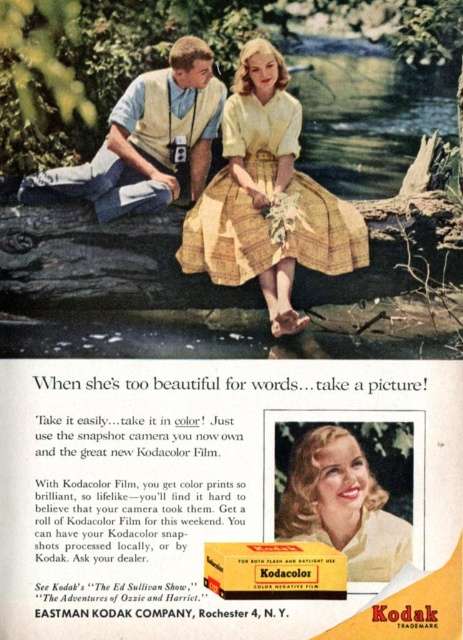
Can you confirm if yellow matte dress at center is shorter than yellow woven dress at center?

Yes.

Does yellow matte dress at center have a greater width compared to yellow woven dress at center?

In fact, yellow matte dress at center might be narrower than yellow woven dress at center.

Is point (379, 499) closer to viewer compared to point (256, 129)?

Yes, point (379, 499) is in front of point (256, 129).

Locate an element on the screen. The image size is (463, 640). yellow matte dress at center is located at coordinates (230, 499).

Does matte blue shirt at upper center have a larger size compared to matte yellow dress at center?

Yes, matte blue shirt at upper center is bigger than matte yellow dress at center.

Does matte blue shirt at upper center appear on the left side of matte yellow dress at center?

Indeed, matte blue shirt at upper center is positioned on the left side of matte yellow dress at center.

Where is `matte blue shirt at upper center`? matte blue shirt at upper center is located at coordinates (146, 140).

In the scene shown: Does yellow woven dress at center have a larger size compared to matte blue shirt at upper center?

Correct, yellow woven dress at center is larger in size than matte blue shirt at upper center.

You are a GUI agent. You are given a task and a screenshot of the screen. Output one action in this format:
    pyautogui.click(x=<x>, y=<y>)
    Task: Click on the yellow woven dress at center
    This screenshot has width=463, height=640.
    Given the screenshot: What is the action you would take?
    pyautogui.click(x=267, y=196)